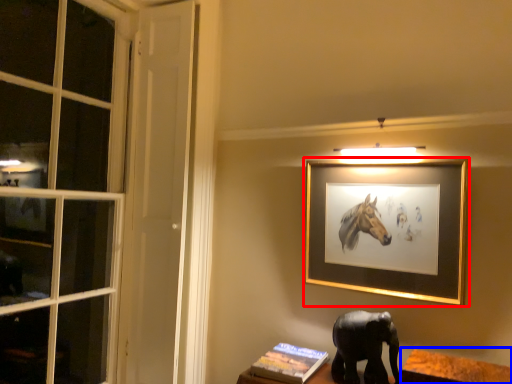
Question: Among these objects, which one is farthest to the camera, picture frame (highlighted by a red box) or table (highlighted by a blue box)?

Choices:
 (A) picture frame
 (B) table

Answer: (A)